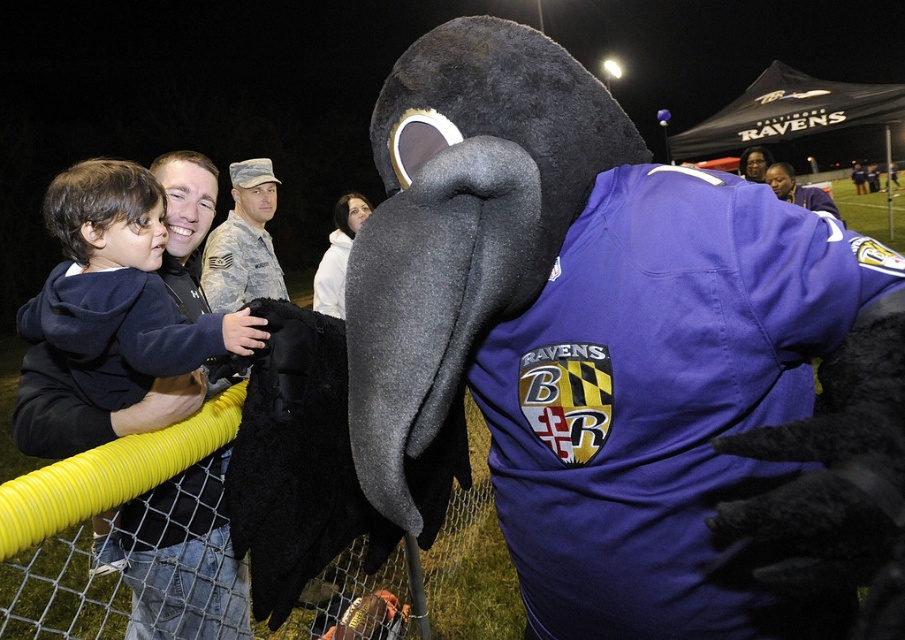
You are a photographer at the event and want to capture both the fuzzy black mascot at center and the camouflage fabric uniform at center in a single shot. Given that your camera has a fixed focal length, which object should you focus on first to ensure both are in frame?

Since the fuzzy black mascot at center is narrower than the camouflage fabric uniform at center, you should focus on the wider camouflage fabric uniform at center first to ensure both fit within the frame.

You are a photographer trying to capture the Baltimore Ravens mascot. You notice a point at coordinates (x=621, y=355) in the image. Based on the scene description, what object is located at this point?

The point at coordinates (x=621, y=355) corresponds to the fuzzy black mascot at center.